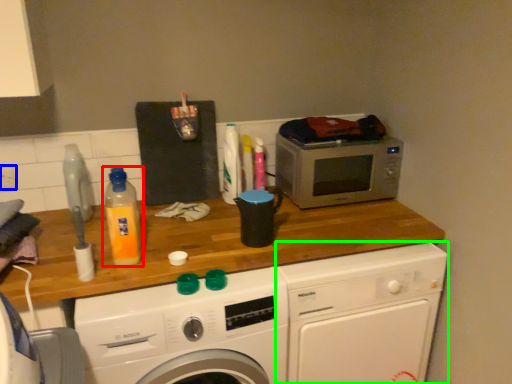
Question: Considering the real-world distances, which object is closest to bottle (highlighted by a red box)? power plugs and sockets (highlighted by a blue box) or washing machine (highlighted by a green box).

Choices:
 (A) power plugs and sockets
 (B) washing machine

Answer: (A)